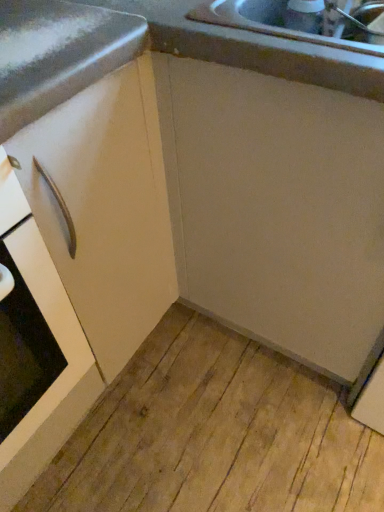
Question: Is matte white cabinet at center a part of white matte cabinet handle at left?

Choices:
 (A) no
 (B) yes

Answer: (A)

Question: From the image's perspective, is white matte cabinet handle at left below matte white cabinet at center?

Choices:
 (A) no
 (B) yes

Answer: (B)

Question: Can you see white matte cabinet handle at left touching matte white cabinet at center?

Choices:
 (A) no
 (B) yes

Answer: (B)

Question: Are white matte cabinet handle at left and matte white cabinet at center far apart?

Choices:
 (A) yes
 (B) no

Answer: (B)

Question: Is white matte cabinet handle at left behind matte white cabinet at center?

Choices:
 (A) yes
 (B) no

Answer: (B)

Question: Is white matte cabinet handle at left closer to the viewer compared to matte white cabinet at center?

Choices:
 (A) yes
 (B) no

Answer: (A)

Question: Is white matte cabinet handle at left inside matte white cabinet at center?

Choices:
 (A) yes
 (B) no

Answer: (B)

Question: Does matte white cabinet at center turn towards white matte cabinet handle at left?

Choices:
 (A) yes
 (B) no

Answer: (B)

Question: Can we say matte white cabinet at center lies outside white matte cabinet handle at left?

Choices:
 (A) no
 (B) yes

Answer: (B)

Question: Considering the relative sizes of matte white cabinet at center and white matte cabinet handle at left in the image provided, is matte white cabinet at center bigger than white matte cabinet handle at left?

Choices:
 (A) no
 (B) yes

Answer: (B)

Question: Is matte white cabinet at center beside white matte cabinet handle at left?

Choices:
 (A) yes
 (B) no

Answer: (A)

Question: Is matte white cabinet at center oriented away from white matte cabinet handle at left?

Choices:
 (A) yes
 (B) no

Answer: (B)

Question: Is point (52, 308) closer or farther from the camera than point (31, 13)?

Choices:
 (A) farther
 (B) closer

Answer: (A)